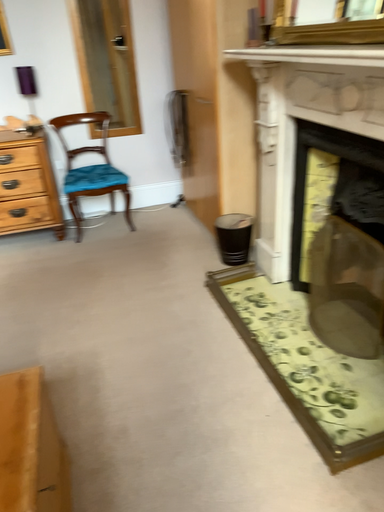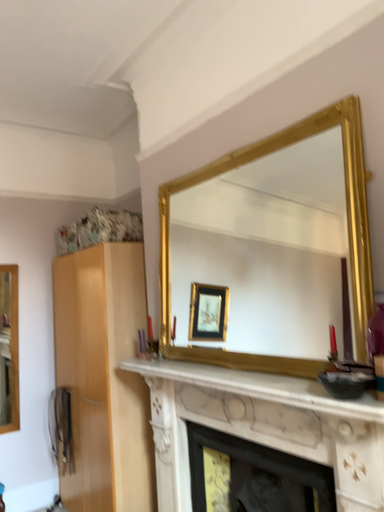
Question: How did the camera likely rotate when shooting the video?

Choices:
 (A) rotated right
 (B) rotated left

Answer: (A)